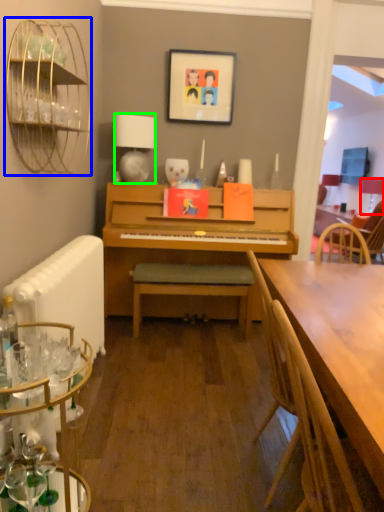
Question: Which is nearer to the lamp (highlighted by a red box)? bird cage (highlighted by a blue box) or lamp (highlighted by a green box).

Choices:
 (A) bird cage
 (B) lamp

Answer: (B)